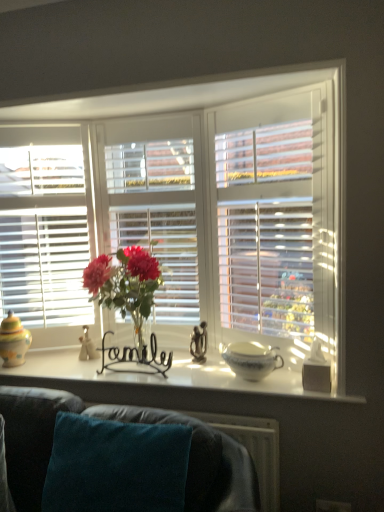
Where is `free space to the back side of black wire at center, the 2th candle holder when ordered from left to right`? This screenshot has height=512, width=384. free space to the back side of black wire at center, the 2th candle holder when ordered from left to right is located at coordinates (146, 361).